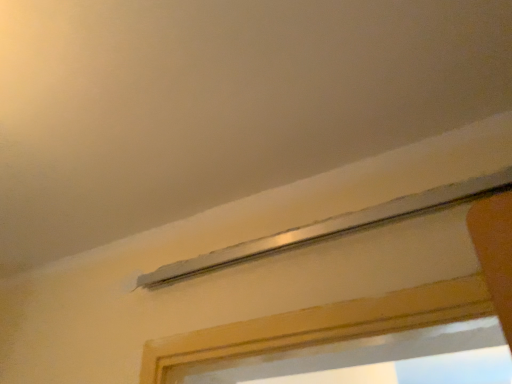
The width and height of the screenshot is (512, 384). What do you see at coordinates (344, 352) in the screenshot? I see `wooden frame at bottom right` at bounding box center [344, 352].

At what (x,y) coordinates should I click in order to perform the action: click on wooden frame at bottom right. Please return your answer as a coordinate pair (x, y). Looking at the image, I should click on (344, 352).

Identify the location of wooden frame at bottom right. coord(344,352).